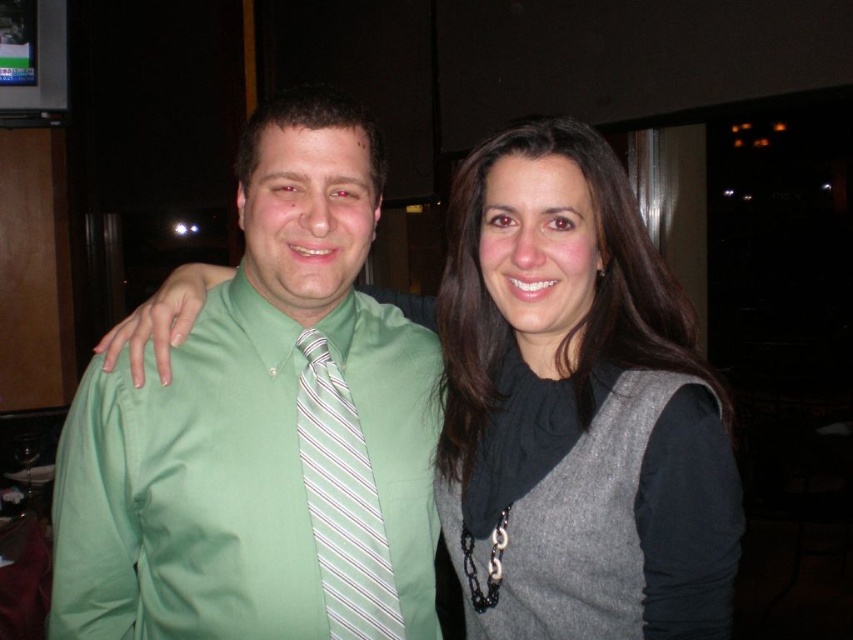
You are organizing a charity event and need to display two items on a table. You have the gray wool vest at right and the white striped tie at center. Since space is limited, you want to know which item requires more space. Which one should you place first to accommodate its size?

The gray wool vest at right has a larger size compared to the white striped tie at center, so you should place the gray wool vest at right first to accommodate its size.

You are a photographer at an event and need to capture a clear photo of the white striped tie at center without the green smooth shirt at center blocking it. How can you adjust your position to achieve this?

The green smooth shirt at center is in front of the white striped tie at center, so you should move your position to the side so that the green smooth shirt at center is no longer blocking the view of the white striped tie at center.